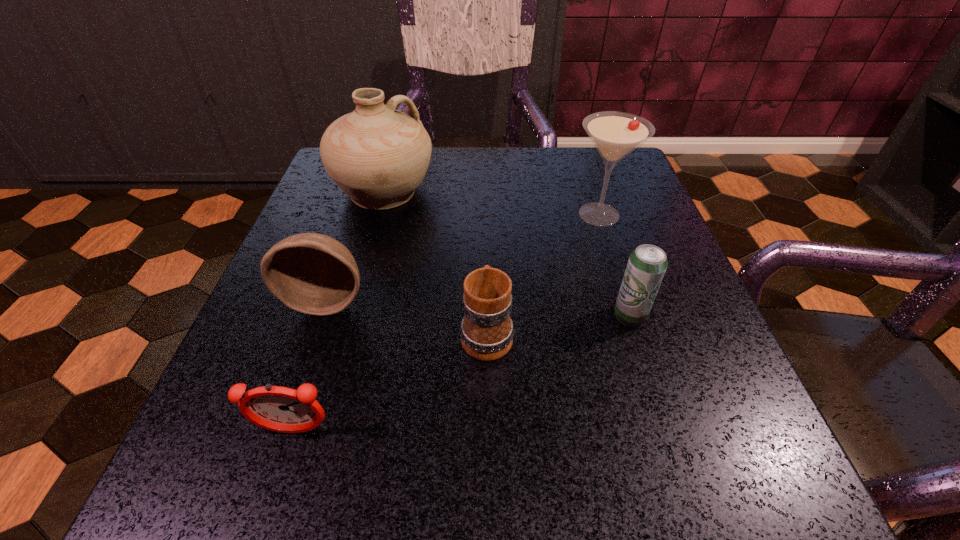
This screenshot has width=960, height=540. Identify the location of vacant area at the near left corner. (282, 444).

What are the coordinates of `vacant point located between the bowl and the third object from right to left` in the screenshot? It's located at (407, 316).

In order to click on unoccupied area between the mug and the shortest object in this screenshot , I will do `click(391, 382)`.

Locate an element on the screen. The height and width of the screenshot is (540, 960). vacant space that is in between the martini and the pottery is located at coordinates (492, 203).

At what (x,y) coordinates should I click in order to perform the action: click on vacant area that lies between the fourth object from left to right and the alarm clock. Please return your answer as a coordinate pair (x, y). This screenshot has width=960, height=540. Looking at the image, I should click on (391, 382).

Find the location of a particular element. free area in between the third object from right to left and the bowl is located at coordinates (407, 316).

Identify the location of free space between the beer can and the alarm clock. Image resolution: width=960 pixels, height=540 pixels. (462, 373).

In order to click on free space between the bowl and the martini in this screenshot , I will do click(x=463, y=257).

The image size is (960, 540). In order to click on vacant point located between the beer can and the pottery in this screenshot , I will do `click(507, 253)`.

The width and height of the screenshot is (960, 540). What are the coordinates of `vacant area that lies between the fourth object from left to right and the martini` in the screenshot? It's located at (542, 273).